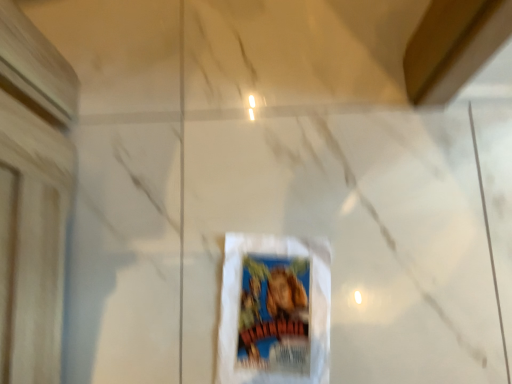
This screenshot has height=384, width=512. Identify the location of white paper poster at center. (274, 310).

Describe the element at coordinates (274, 310) in the screenshot. I see `white paper poster at center` at that location.

Locate an element on the screen. The image size is (512, 384). white paper poster at center is located at coordinates (274, 310).